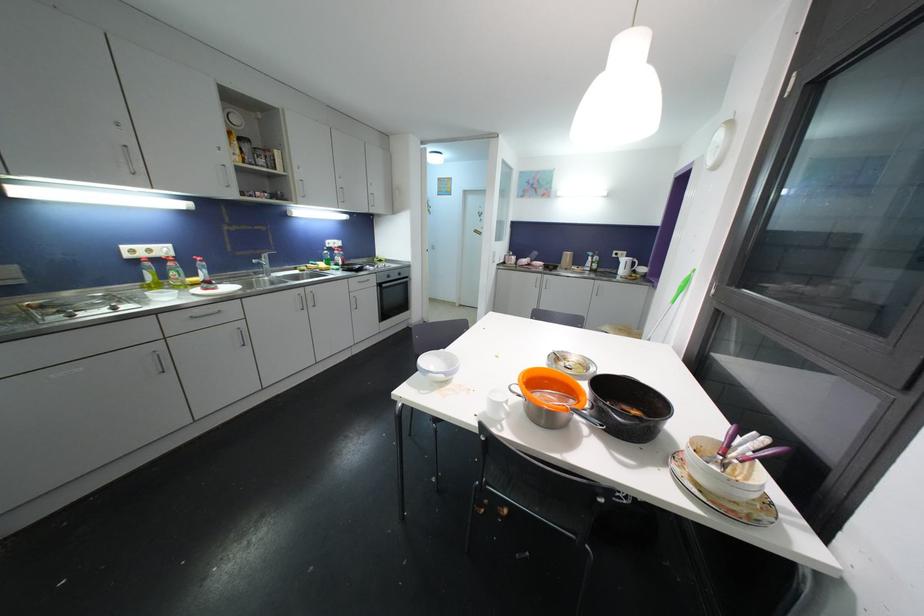
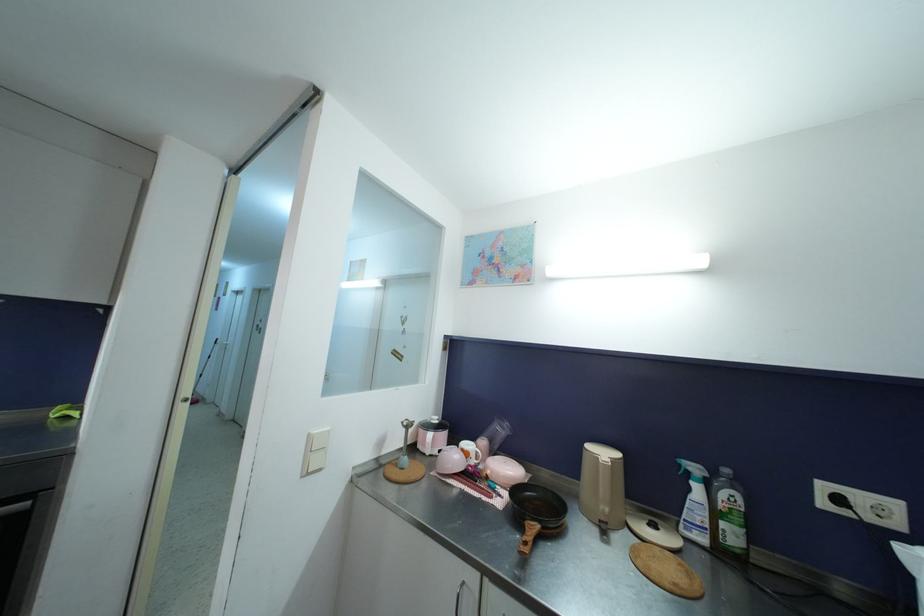
In the second image, find the point that corresponds to (616,257) in the first image.

(827, 507)